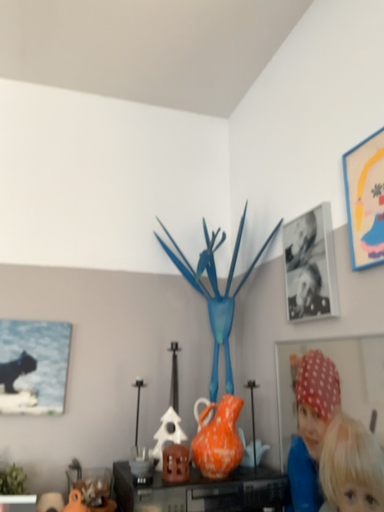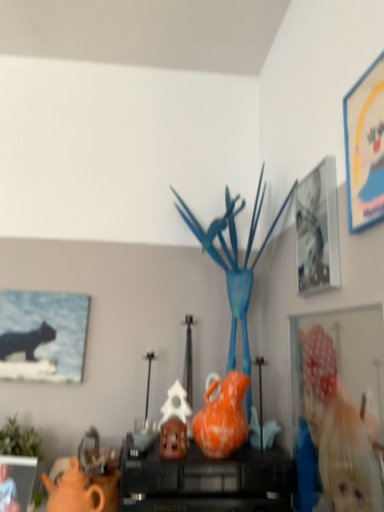
Question: How did the camera likely rotate when shooting the video?

Choices:
 (A) rotated right
 (B) rotated left

Answer: (B)